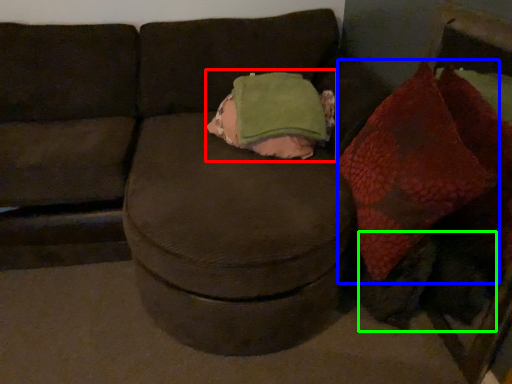
Question: Which object is the closest to the throw pillow (highlighted by a red box)? Choose among these: bean bag chair (highlighted by a blue box) or animal (highlighted by a green box).

Choices:
 (A) bean bag chair
 (B) animal

Answer: (A)